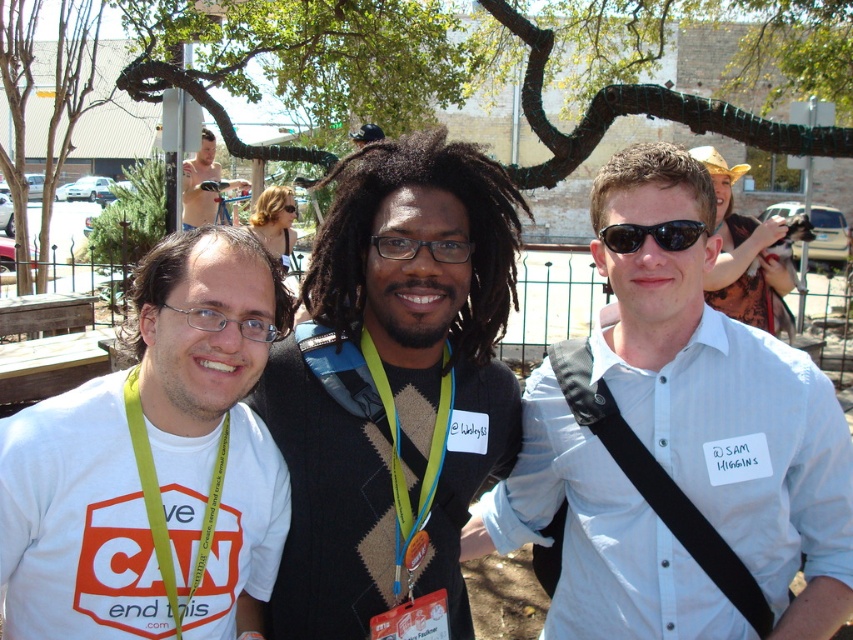
Looking at this image, between brown sweater at center and shiny metallic body at upper left, which one appears on the left side from the viewer's perspective?

Positioned to the left is shiny metallic body at upper left.

Who is higher up, brown sweater at center or shiny metallic body at upper left?

shiny metallic body at upper left is higher up.

Which is behind, point (430, 532) or point (218, 172)?

The point (218, 172) is more distant.

This screenshot has width=853, height=640. I want to click on brown sweater at center, so click(392, 387).

Is white matte t-shirt at left above white matte neck at center?

No, white matte t-shirt at left is not above white matte neck at center.

Can you confirm if white matte t-shirt at left is shorter than white matte neck at center?

In fact, white matte t-shirt at left may be taller than white matte neck at center.

Find the location of `white matte t-shirt at left`. white matte t-shirt at left is located at coordinates (154, 461).

At what (x,y) coordinates should I click in order to perform the action: click on white matte t-shirt at left. Please return your answer as a coordinate pair (x, y). Looking at the image, I should click on (154, 461).

Who is more forward, (x=135, y=396) or (x=691, y=241)?

Point (x=135, y=396) is more forward.

Who is more distant from viewer, (169, 572) or (627, 243)?

The point (627, 243) is more distant.

In order to click on green fabric lanyard at left in this screenshot , I will do `click(161, 502)`.